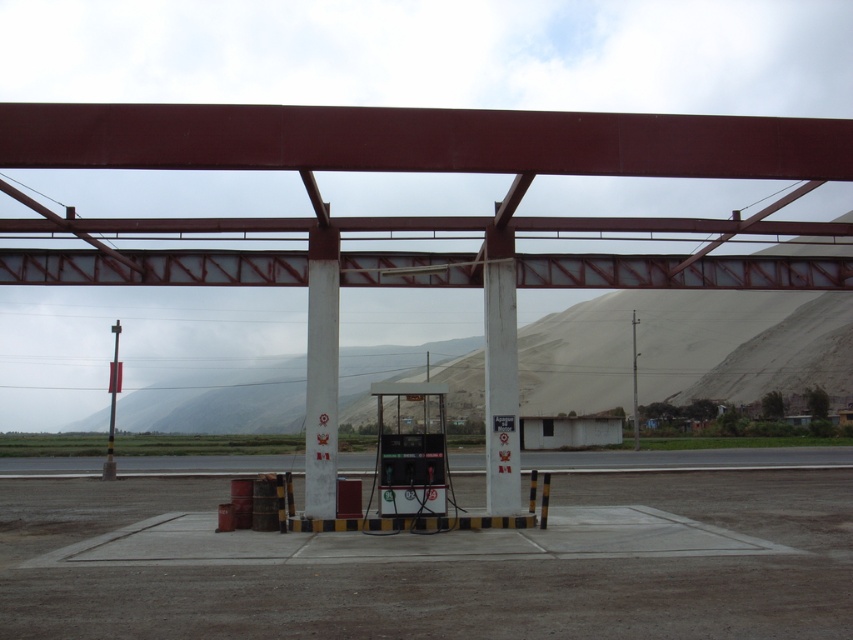
Can you confirm if gray asphalt runway at lower center is positioned to the left of metallic pole at left?

No, gray asphalt runway at lower center is not to the left of metallic pole at left.

Does gray asphalt runway at lower center appear over metallic pole at left?

No, gray asphalt runway at lower center is not above metallic pole at left.

At what (x,y) coordinates should I click in order to perform the action: click on gray asphalt runway at lower center. Please return your answer as a coordinate pair (x, y). The image size is (853, 640). Looking at the image, I should click on 689,458.

Does point (241, 460) come farther from viewer compared to point (490, 276)?

Yes, point (241, 460) is behind point (490, 276).

The width and height of the screenshot is (853, 640). What do you see at coordinates (689, 458) in the screenshot? I see `gray asphalt runway at lower center` at bounding box center [689, 458].

What are the coordinates of `gray asphalt runway at lower center` in the screenshot? It's located at (689, 458).

Does point (164, 228) come farther from viewer compared to point (71, 468)?

That is False.

Can you confirm if smooth red steel overpass at center is positioned above gray asphalt runway at lower center?

Correct, smooth red steel overpass at center is located above gray asphalt runway at lower center.

The height and width of the screenshot is (640, 853). Describe the element at coordinates (440, 150) in the screenshot. I see `smooth red steel overpass at center` at that location.

Identify the location of smooth red steel overpass at center. The height and width of the screenshot is (640, 853). (440, 150).